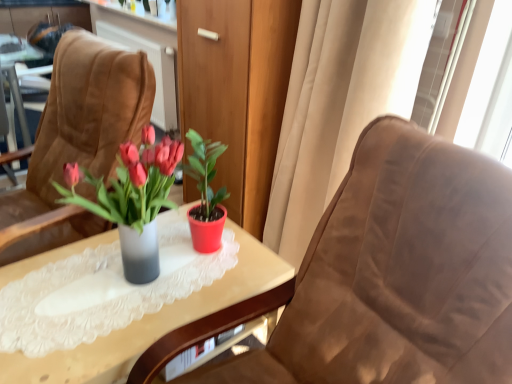
Question: From a real-world perspective, does beige fabric curtain at right sit lower than suede chair at left, the second chair in the right-to-left sequence?

Choices:
 (A) no
 (B) yes

Answer: (A)

Question: Can you confirm if beige fabric curtain at right is shorter than suede chair at left, the second chair in the right-to-left sequence?

Choices:
 (A) yes
 (B) no

Answer: (B)

Question: Is beige fabric curtain at right directly adjacent to suede chair at left, placed as the first chair when sorted from left to right?

Choices:
 (A) no
 (B) yes

Answer: (A)

Question: Is beige fabric curtain at right outside of suede chair at left, the second chair in the right-to-left sequence?

Choices:
 (A) no
 (B) yes

Answer: (B)

Question: Does beige fabric curtain at right turn towards suede chair at left, placed as the first chair when sorted from left to right?

Choices:
 (A) no
 (B) yes

Answer: (A)

Question: Considering the positions of point (0, 261) and point (349, 34), is point (0, 261) closer or farther from the camera than point (349, 34)?

Choices:
 (A) farther
 (B) closer

Answer: (B)

Question: Is suede chair at left, placed as the first chair when sorted from left to right, inside the boundaries of beige fabric curtain at right, or outside?

Choices:
 (A) inside
 (B) outside

Answer: (B)

Question: In terms of height, does suede chair at left, the second chair in the right-to-left sequence, look taller or shorter compared to beige fabric curtain at right?

Choices:
 (A) tall
 (B) short

Answer: (B)

Question: From the image's perspective, is suede chair at left, placed as the first chair when sorted from left to right, positioned above or below beige fabric curtain at right?

Choices:
 (A) above
 (B) below

Answer: (B)

Question: Considering the positions of point (33, 382) and point (272, 231), is point (33, 382) closer or farther from the camera than point (272, 231)?

Choices:
 (A) farther
 (B) closer

Answer: (B)

Question: Is translucent glass vase at center taller or shorter than beige fabric curtain at right?

Choices:
 (A) short
 (B) tall

Answer: (A)

Question: Choose the correct answer: Is translucent glass vase at center inside beige fabric curtain at right or outside it?

Choices:
 (A) outside
 (B) inside

Answer: (A)

Question: From a real-world perspective, is translucent glass vase at center physically located above or below beige fabric curtain at right?

Choices:
 (A) below
 (B) above

Answer: (A)

Question: Does point (151, 208) appear closer or farther from the camera than point (105, 49)?

Choices:
 (A) farther
 (B) closer

Answer: (B)

Question: From the image's perspective, is matte plastic vase at center located above or below suede chair at left, placed as the first chair when sorted from left to right?

Choices:
 (A) above
 (B) below

Answer: (B)